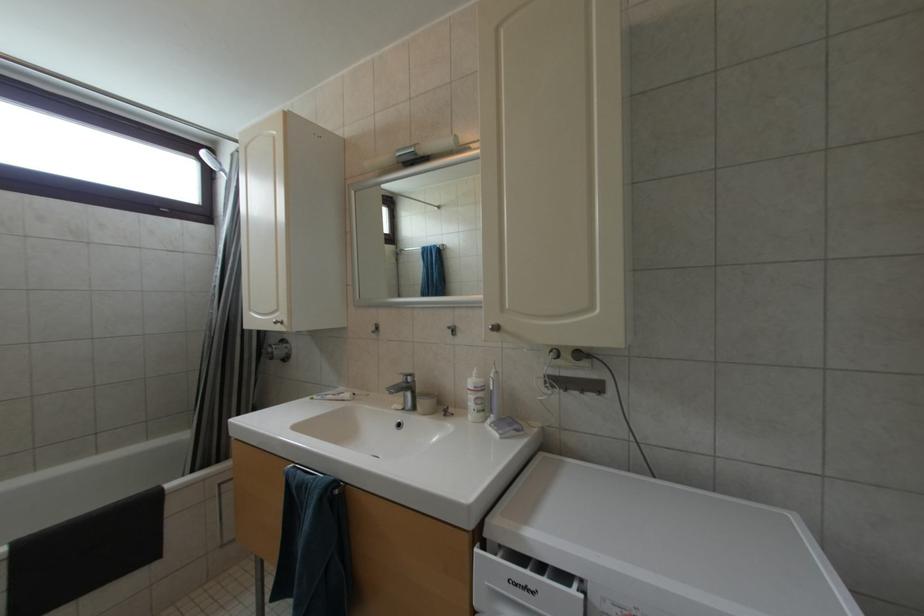
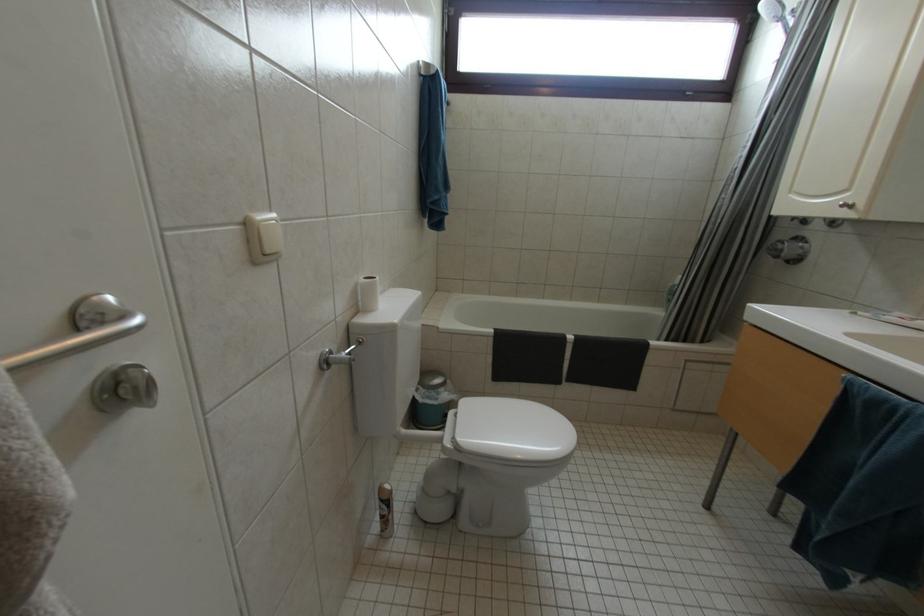
From the picture: The images are taken continuously from a first-person perspective. In which direction is your viewpoint rotating?

The camera rotated toward left-down.